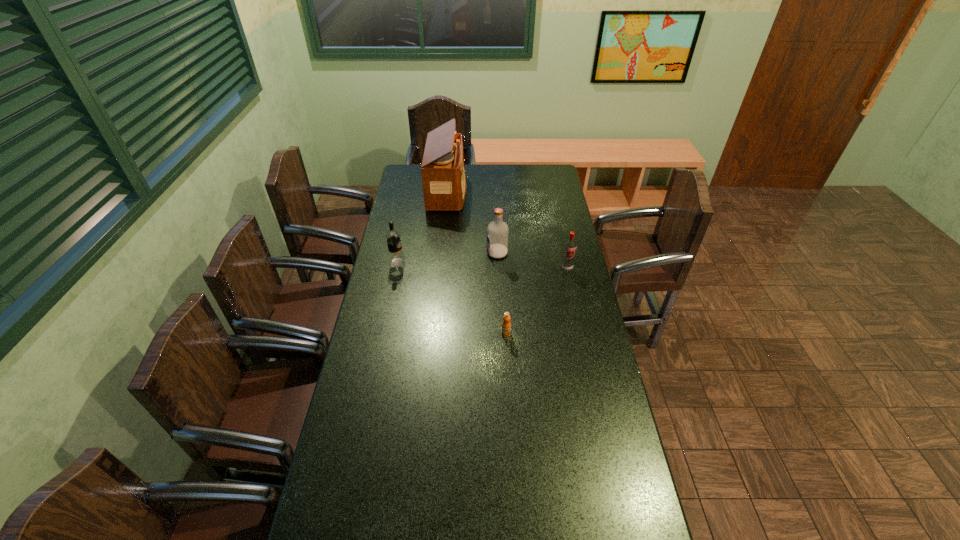
Identify the location of the fourth object from right to left. (443, 170).

The width and height of the screenshot is (960, 540). What are the coordinates of `the farthest object` in the screenshot? It's located at (443, 170).

Where is `the second vodka from right to left`? The image size is (960, 540). the second vodka from right to left is located at coordinates (497, 231).

Identify the location of the leftmost vodka. (396, 258).

The height and width of the screenshot is (540, 960). I want to click on the shortest vodka, so click(x=570, y=245).

Where is `the rightmost object`? This screenshot has height=540, width=960. the rightmost object is located at coordinates (570, 245).

Find the location of `orange juice`. orange juice is located at coordinates click(506, 324).

Locate an element on the screen. the nearest object is located at coordinates (506, 324).

The height and width of the screenshot is (540, 960). What are the coordinates of `free point located on the front panel of the radio receiver` in the screenshot? It's located at (476, 192).

Where is `vacant position located on the label of the second vodka from right to left`? Image resolution: width=960 pixels, height=540 pixels. vacant position located on the label of the second vodka from right to left is located at coordinates (444, 253).